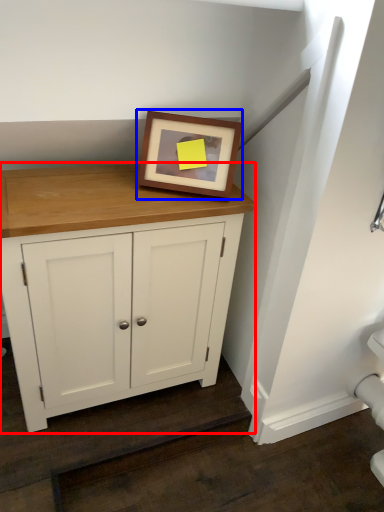
Question: Which of the following is the farthest to the observer, cupboard (highlighted by a red box) or picture frame (highlighted by a blue box)?

Choices:
 (A) cupboard
 (B) picture frame

Answer: (B)